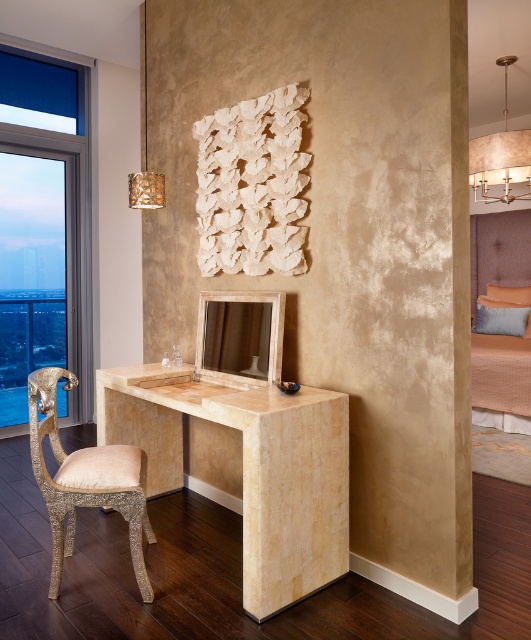
You are designing a layout for a small apartment and need to place both the gold glittery armchair at left and the beige fabric bed at right. Given their sizes, which one can you fit through a standard doorway first without needing to disassemble?

The gold glittery armchair at left can be fit through the doorway first because its width is less than the beige fabric bed at right.

You are a guest in this room and want to place a small vase on the beige marble desk at center. However, you are concerned about the height difference between the desk and the gold glittery armchair at left. Can you confirm if the desk is tall enough to prevent the vase from being hidden by the chair?

The beige marble desk at center is shorter than the gold glittery armchair at left, so the desk may not be tall enough to prevent the vase from being hidden by the chair. Consider placing the vase elsewhere or using a taller surface.

You are a delivery person who needs to place a rectangular package that is 20 inches long on the floor between the beige marble desk at center and the gold glittery armchair at left. Can the package fit horizontally between them?

The distance between the beige marble desk at center and the gold glittery armchair at left is 18.96 inches. Since the package is 20 inches long, it cannot fit horizontally between them as the space is narrower than the package.